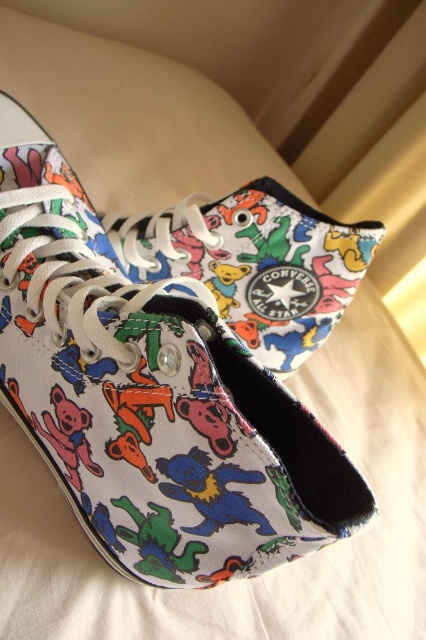
Which is more to the right, canvas sneakers at center or multicolored canvas sneakers at center?

Positioned to the right is multicolored canvas sneakers at center.

Is canvas sneakers at center behind multicolored canvas sneakers at center?

No, canvas sneakers at center is closer to the viewer.

Where is `canvas sneakers at center`? canvas sneakers at center is located at coordinates (175, 365).